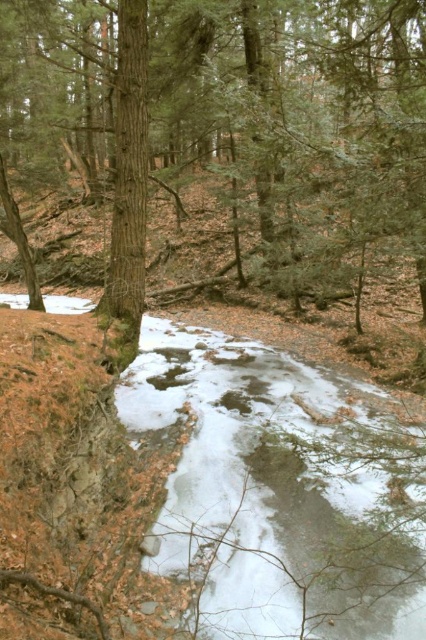
You are a hiker trying to cross the white frozen stream at center. There is a brown wood tree at center nearby. Can you use the tree to help you cross the stream safely?

The brown wood tree at center might be wider than the white frozen stream at center, so it could potentially provide a stable support point for crossing the stream safely.

You are standing in the forest and want to cross the stream. You see the brown wood tree at center and the white frozen stream at center. Which object is closer to you, and can you step over the stream without getting wet?

The brown wood tree at center is closer to you. Since the white frozen stream at center is behind it, you can step over the stream without getting wet by going around the tree.